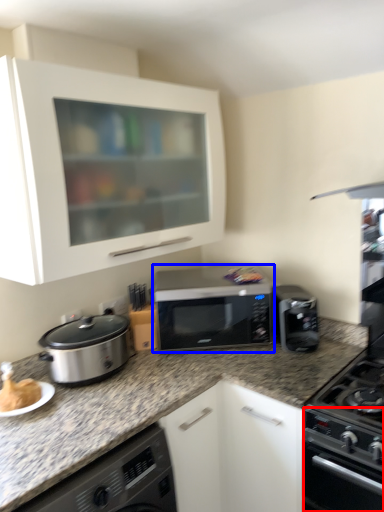
Question: Which of the following is the farthest to the observer, oven (highlighted by a red box) or microwave oven (highlighted by a blue box)?

Choices:
 (A) oven
 (B) microwave oven

Answer: (B)